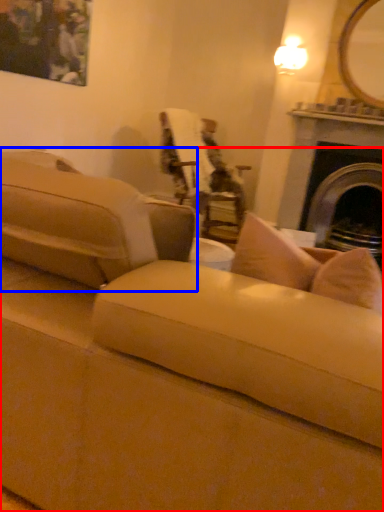
Question: Which point is further to the camera, studio couch (highlighted by a red box) or studio couch (highlighted by a blue box)?

Choices:
 (A) studio couch
 (B) studio couch

Answer: (B)